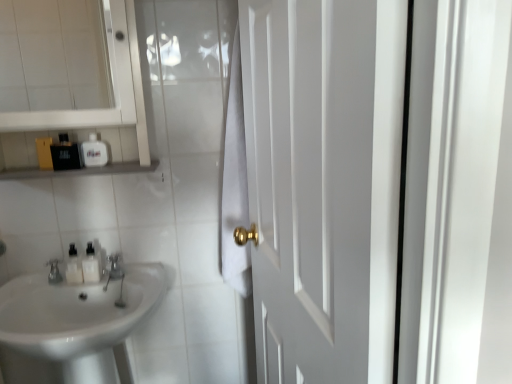
You are a GUI agent. You are given a task and a screenshot of the screen. Output one action in this format:
    pyautogui.click(x=<x>, y=<y>)
    Task: Click on the white glossy soap dispenser at left, the 2th toiletry in the bottom-to-top sequence
    
    Given the screenshot: What is the action you would take?
    pyautogui.click(x=91, y=265)

The height and width of the screenshot is (384, 512). What do you see at coordinates (115, 267) in the screenshot? I see `brushed metal faucet at lower left` at bounding box center [115, 267].

This screenshot has height=384, width=512. I want to click on brushed metal faucet at lower left, so click(x=115, y=267).

Looking at this image, measure the distance between matte black bottle at upper left, which appears as the 1th toiletry when viewed from the top, and camera.

A distance of 4.60 feet exists between matte black bottle at upper left, which appears as the 1th toiletry when viewed from the top, and camera.

I want to click on white matte door at right, so click(x=324, y=183).

What do you see at coordinates (324, 183) in the screenshot?
I see `white matte door at right` at bounding box center [324, 183].

I want to click on black plastic container at upper left, so point(78,170).

Where is `matte silver faucet at lower left`? The height and width of the screenshot is (384, 512). matte silver faucet at lower left is located at coordinates (54, 271).

At what (x,y) coordinates should I click in order to perform the action: click on white glossy soap dispenser at left, the 2th toiletry in the bottom-to-top sequence. Please return your answer as a coordinate pair (x, y). Looking at the image, I should click on (91, 265).

Considering the sizes of objects white glossy soap dispenser at left, which is counted as the 2th toiletry, starting from the top, and brushed metal faucet at lower left in the image provided, who is thinner, white glossy soap dispenser at left, which is counted as the 2th toiletry, starting from the top, or brushed metal faucet at lower left?

Thinner between the two is white glossy soap dispenser at left, which is counted as the 2th toiletry, starting from the top.

From the image's perspective, is white glossy soap dispenser at left, the 2th toiletry in the bottom-to-top sequence, located above or below brushed metal faucet at lower left?

From the image's perspective, white glossy soap dispenser at left, the 2th toiletry in the bottom-to-top sequence, appears above brushed metal faucet at lower left.

From a real-world perspective, who is located higher, white glossy soap dispenser at left, which is counted as the 2th toiletry, starting from the top, or brushed metal faucet at lower left?

white glossy soap dispenser at left, which is counted as the 2th toiletry, starting from the top, is physically above.

Where is `faucet that appears in front of the white glossy soap dispenser at left, the 2th toiletry in the bottom-to-top sequence`? The width and height of the screenshot is (512, 384). faucet that appears in front of the white glossy soap dispenser at left, the 2th toiletry in the bottom-to-top sequence is located at coordinates (115, 267).

Is matte black bottle at upper left, which appears as the 1th toiletry when viewed from the top, directly adjacent to brushed metal faucet at lower left?

No, matte black bottle at upper left, which appears as the 1th toiletry when viewed from the top, is not beside brushed metal faucet at lower left.

In terms of height, does matte black bottle at upper left, which appears as the 1th toiletry when viewed from the top, look taller or shorter compared to brushed metal faucet at lower left?

matte black bottle at upper left, which appears as the 1th toiletry when viewed from the top, is taller than brushed metal faucet at lower left.

From the image's perspective, is matte black bottle at upper left, the 3th toiletry ordered from the bottom, below brushed metal faucet at lower left?

No, from the image's perspective, matte black bottle at upper left, the 3th toiletry ordered from the bottom, is not below brushed metal faucet at lower left.

Which of these two, matte black bottle at upper left, which appears as the 1th toiletry when viewed from the top, or brushed metal faucet at lower left, is wider?

brushed metal faucet at lower left is wider.

Are matte black bottle at upper left, which appears as the 1th toiletry when viewed from the top, and black plastic container at upper left far apart?

No, matte black bottle at upper left, which appears as the 1th toiletry when viewed from the top, is not far from black plastic container at upper left.

Identify the location of the 1st toiletry to the left of the black plastic container at upper left, counting from the anchor's position. (66, 154).

Is matte black bottle at upper left, which appears as the 1th toiletry when viewed from the top, at the right side of black plastic container at upper left?

No.

Between white glossy soap dispenser at left, which is counted as the 2th toiletry, starting from the top, and white glossy bottles at left, which is counted as the third toiletry, starting from the top, which one is positioned behind?

white glossy soap dispenser at left, which is counted as the 2th toiletry, starting from the top.

Is white glossy soap dispenser at left, which is counted as the 2th toiletry, starting from the top, beside white glossy bottles at left, which is counted as the third toiletry, starting from the top?

Yes, white glossy soap dispenser at left, which is counted as the 2th toiletry, starting from the top, is next to white glossy bottles at left, which is counted as the third toiletry, starting from the top.

Is white glossy soap dispenser at left, which is counted as the 2th toiletry, starting from the top, shorter than white glossy bottles at left, which is counted as the third toiletry, starting from the top?

In fact, white glossy soap dispenser at left, which is counted as the 2th toiletry, starting from the top, may be taller than white glossy bottles at left, which is counted as the third toiletry, starting from the top.

Does point (85, 269) lie in front of point (81, 265)?

Yes, it is.

Could white glossy soap dispenser at left, which is counted as the 2th toiletry, starting from the top, be considered to be inside white matte door at right?

Definitely not — white glossy soap dispenser at left, which is counted as the 2th toiletry, starting from the top, is not inside white matte door at right.

Based on the photo, from the image's perspective, between white matte door at right and white glossy soap dispenser at left, the 2th toiletry in the bottom-to-top sequence, who is located below?

white glossy soap dispenser at left, the 2th toiletry in the bottom-to-top sequence.

Can you confirm if white matte door at right is thinner than white glossy soap dispenser at left, the 2th toiletry in the bottom-to-top sequence?

No, white matte door at right is not thinner than white glossy soap dispenser at left, the 2th toiletry in the bottom-to-top sequence.

Who is smaller, brushed metal faucet at lower left or white matte door at right?

Smaller between the two is brushed metal faucet at lower left.

In order to click on faucet located underneath the white matte door at right (from a real-world perspective) in this screenshot , I will do `click(115, 267)`.

From the image's perspective, which one is positioned higher, brushed metal faucet at lower left or white matte door at right?

From the image's view, white matte door at right is above.

Which object is further away from the camera, brushed metal faucet at lower left or white matte door at right?

brushed metal faucet at lower left is behind.

From the image's perspective, is white glossy medicine cabinet at upper left located beneath matte black bottle at upper left, the 3th toiletry ordered from the bottom?

No.

Is white glossy medicine cabinet at upper left positioned in front of matte black bottle at upper left, the 3th toiletry ordered from the bottom?

That is True.

Choose the correct answer: Is white glossy medicine cabinet at upper left inside matte black bottle at upper left, the 3th toiletry ordered from the bottom, or outside it?

white glossy medicine cabinet at upper left is outside matte black bottle at upper left, the 3th toiletry ordered from the bottom.

Locate an element on the screen. This screenshot has height=384, width=512. faucet that is under the white glossy soap dispenser at left, which is counted as the 2th toiletry, starting from the top (from a real-world perspective) is located at coordinates (115, 267).

The height and width of the screenshot is (384, 512). Identify the location of the 2nd toiletry to the left of the brushed metal faucet at lower left, starting your count from the anchor. (66, 154).

Considering their positions, is white glossy sink at lower left positioned further to white matte door at right than black plastic container at upper left?

black plastic container at upper left is further to white matte door at right.

Considering their positions, is white glossy soap dispenser at left, which is counted as the 2th toiletry, starting from the top, positioned closer to matte silver faucet at lower left than brushed metal faucet at lower left?

white glossy soap dispenser at left, which is counted as the 2th toiletry, starting from the top.

From the image, which object appears to be nearer to white glossy sink at lower left, brushed metal faucet at lower left or white glossy bottles at left, which is counted as the third toiletry, starting from the top?

white glossy bottles at left, which is counted as the third toiletry, starting from the top, is positioned closer to the anchor white glossy sink at lower left.

Which object lies further to the anchor point white glossy bottles at left, which is the 1th toiletry from bottom to top, white glossy soap dispenser at left, the 2th toiletry in the bottom-to-top sequence, or white glossy medicine cabinet at upper left?

The object further to white glossy bottles at left, which is the 1th toiletry from bottom to top, is white glossy medicine cabinet at upper left.

Based on their spatial positions, is white glossy soap dispenser at left, the 2th toiletry in the bottom-to-top sequence, or white glossy soap dispenser at upper left further from matte silver faucet at lower left?

white glossy soap dispenser at upper left is further to matte silver faucet at lower left.

Estimate the real-world distances between objects in this image. Which object is further from white matte door at right, matte silver faucet at lower left or white glossy bottles at left, which is counted as the third toiletry, starting from the top?

The object further to white matte door at right is matte silver faucet at lower left.

Looking at the image, which one is located closer to white matte door at right, black plastic container at upper left or matte black bottle at upper left, which appears as the 1th toiletry when viewed from the top?

The object closer to white matte door at right is black plastic container at upper left.

Estimate the real-world distances between objects in this image. Which object is closer to white glossy bottles at left, which is counted as the third toiletry, starting from the top, brushed metal faucet at lower left or matte black bottle at upper left, which appears as the 1th toiletry when viewed from the top?

Among the two, brushed metal faucet at lower left is located nearer to white glossy bottles at left, which is counted as the third toiletry, starting from the top.

The width and height of the screenshot is (512, 384). I want to click on medicine cabinet positioned between white matte door at right and matte silver faucet at lower left from near to far, so click(105, 108).

Locate an element on the screen. The height and width of the screenshot is (384, 512). balustrade between white glossy soap dispenser at upper left and white glossy soap dispenser at left, which is counted as the 2th toiletry, starting from the top, vertically is located at coordinates (78, 170).

Where is `balustrade that lies between white glossy medicine cabinet at upper left and white glossy soap dispenser at left, the 2th toiletry in the bottom-to-top sequence, from top to bottom`? This screenshot has height=384, width=512. balustrade that lies between white glossy medicine cabinet at upper left and white glossy soap dispenser at left, the 2th toiletry in the bottom-to-top sequence, from top to bottom is located at coordinates (78, 170).

I want to click on faucet between black plastic container at upper left and white glossy sink at lower left in the up-down direction, so click(115, 267).